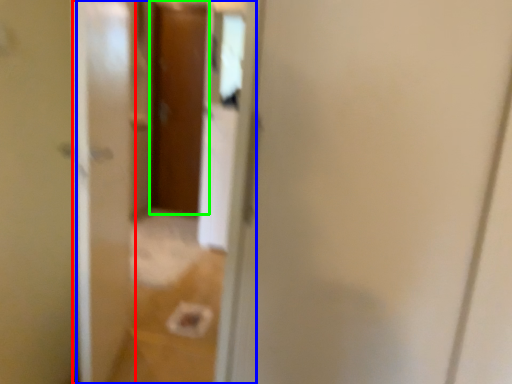
Question: Which is farther away from screen door (highlighted by a red box)? glass door (highlighted by a blue box) or door (highlighted by a green box)?

Choices:
 (A) glass door
 (B) door

Answer: (B)